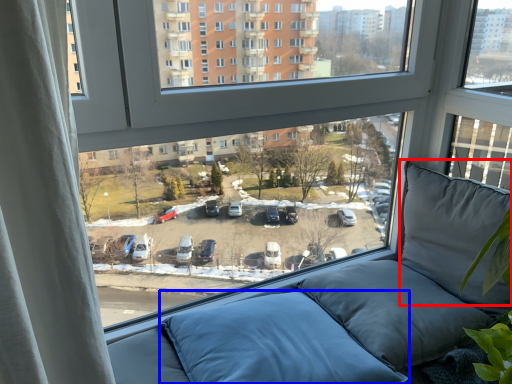
Question: Which point is closer to the camera, pillow (highlighted by a red box) or pillow (highlighted by a blue box)?

Choices:
 (A) pillow
 (B) pillow

Answer: (B)